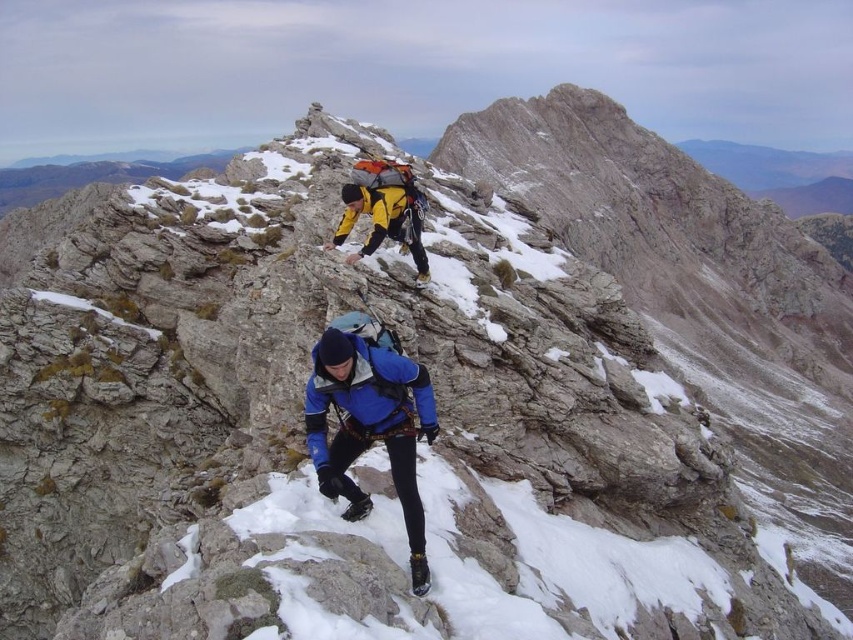
You are a hiker planning to join the climbers. You need to know if you can safely pass between the blue fabric jacket at lower center and the yellow matte jacket at center without disturbing them. Can you do this?

The blue fabric jacket at lower center is in front of the yellow matte jacket at center, so there is no space between them for you to pass safely without disturbing them.

You are a drone operator trying to capture the two climbers on the mountain ridge. The climbers are located at point (416, 541) and point (352, 186). Which point should you focus on first to ensure the climber is closer to the camera?

Point (416, 541) is closer to the camera than point (352, 186), so you should focus on point (416, 541) first to capture the climber closer to the camera.

You are a hiker planning to join the climbers. From your current position, which jacket do you see first as you look towards the mountain ridge? The blue fabric jacket at lower center or the yellow matte jacket at center?

The yellow matte jacket at center is seen first because it is positioned closer to your viewpoint compared to the blue fabric jacket at lower center, which is to the right of it.